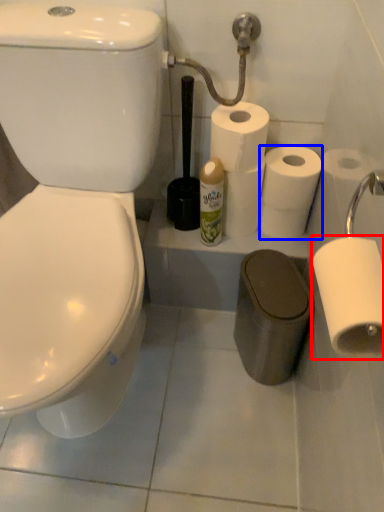
Question: Among these objects, which one is nearest to the camera, toilet paper (highlighted by a red box) or toilet paper (highlighted by a blue box)?

Choices:
 (A) toilet paper
 (B) toilet paper

Answer: (A)